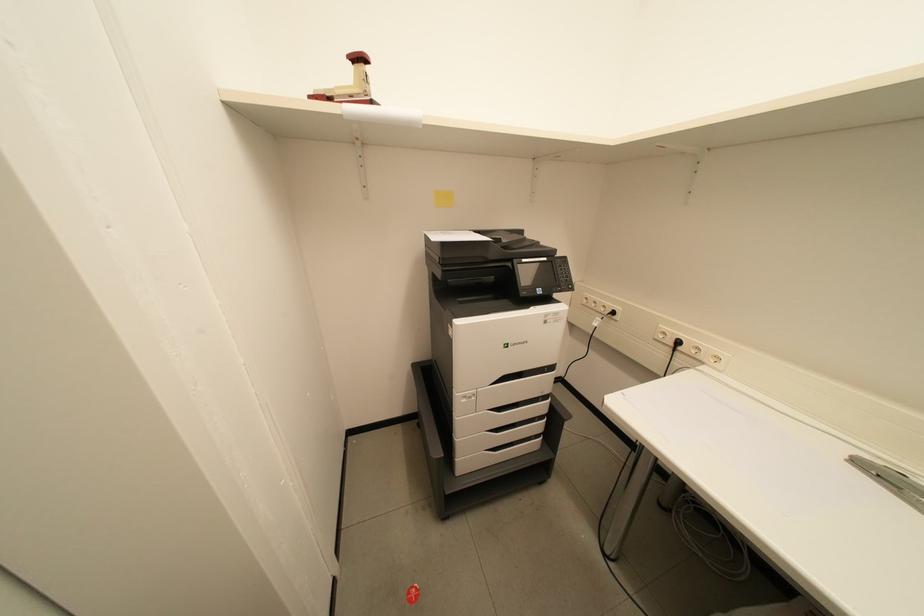
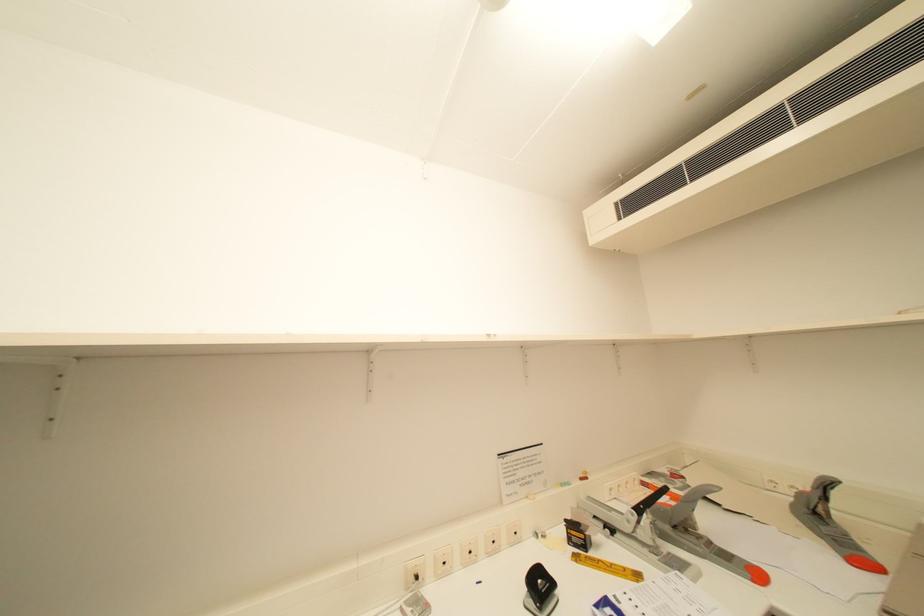
Question: The images are taken continuously from a first-person perspective. In which direction is your viewpoint rotating?

Choices:
 (A) Left
 (B) Right
 (C) Up
 (D) Down

Answer: (B)